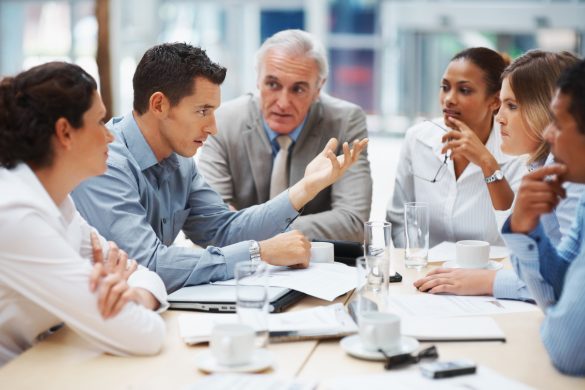
You are a GUI agent. You are given a task and a screenshot of the screen. Output one action in this format:
    pyautogui.click(x=<x>, y=<y>)
    Task: Click on the drinkware
    
    Given the screenshot: What is the action you would take?
    pyautogui.click(x=380, y=244), pyautogui.click(x=371, y=288), pyautogui.click(x=245, y=273), pyautogui.click(x=377, y=337), pyautogui.click(x=230, y=335), pyautogui.click(x=477, y=256), pyautogui.click(x=412, y=227), pyautogui.click(x=320, y=246)